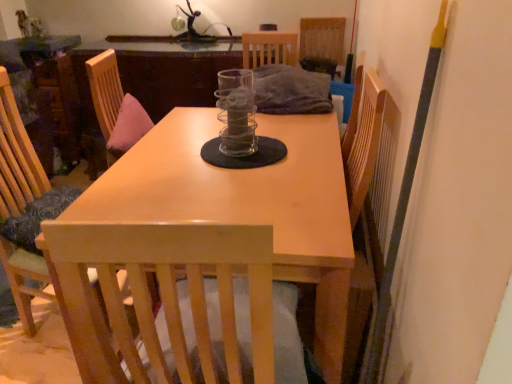
What do you see at coordinates (236, 112) in the screenshot? I see `clear glass jar at center` at bounding box center [236, 112].

Identify the location of clear glass jar at center. This screenshot has height=384, width=512. (236, 112).

From the image's perspective, is metallic glass sculpture at upper center above or below woven fabric chair at upper center, which is the second chair in bottom-to-top order?

Clearly, from the image's perspective, metallic glass sculpture at upper center is above woven fabric chair at upper center, which is the second chair in bottom-to-top order.

Are metallic glass sculpture at upper center and woven fabric chair at upper center, the 2th chair from the left, making contact?

No, metallic glass sculpture at upper center is not beside woven fabric chair at upper center, the 2th chair from the left.

Is metallic glass sculpture at upper center in front of or behind woven fabric chair at upper center, the 1th chair positioned from the top, in the image?

metallic glass sculpture at upper center is positioned farther from the viewer than woven fabric chair at upper center, the 1th chair positioned from the top.

Is wooden chair at left, arranged as the first chair when viewed from the front, outside of clear glass jar at center?

wooden chair at left, arranged as the first chair when viewed from the front, lies outside clear glass jar at center's area.

From a real-world perspective, which is physically below, wooden chair at left, arranged as the first chair when viewed from the front, or clear glass jar at center?

wooden chair at left, arranged as the first chair when viewed from the front, is physically lower.

Can you confirm if wooden chair at left, arranged as the first chair when viewed from the front, is positioned to the right of clear glass jar at center?

No, wooden chair at left, arranged as the first chair when viewed from the front, is not to the right of clear glass jar at center.

Where is `glass jar behind the wooden chair at left, arranged as the first chair when viewed from the front`? glass jar behind the wooden chair at left, arranged as the first chair when viewed from the front is located at coordinates (236, 112).

From a real-world perspective, is light wood table at center above or below wooden chair at left, arranged as the first chair when viewed from the front?

light wood table at center is below wooden chair at left, arranged as the first chair when viewed from the front.

Considering their positions, is light wood table at center located in front of or behind wooden chair at left, the 2th chair when ordered from top to bottom?

Visually, light wood table at center is located in front of wooden chair at left, the 2th chair when ordered from top to bottom.

Could you tell me if light wood table at center is turned towards wooden chair at left, marked as the first chair in a left-to-right arrangement?

Yes, light wood table at center is aimed at wooden chair at left, marked as the first chair in a left-to-right arrangement.

This screenshot has width=512, height=384. Find the location of `table located underneath the wooden chair at left, marked as the first chair in a left-to-right arrangement (from a real-world perspective)`. table located underneath the wooden chair at left, marked as the first chair in a left-to-right arrangement (from a real-world perspective) is located at coordinates (246, 203).

Would you say clear glass jar at center is inside or outside wooden chair at left, marked as the second chair in a right-to-left arrangement?

clear glass jar at center is located beyond the bounds of wooden chair at left, marked as the second chair in a right-to-left arrangement.

Visually, is clear glass jar at center positioned to the left or to the right of wooden chair at left, the 2th chair when ordered from top to bottom?

Based on their positions, clear glass jar at center is located to the right of wooden chair at left, the 2th chair when ordered from top to bottom.

Is clear glass jar at center behind wooden chair at left, marked as the second chair in a right-to-left arrangement?

Yes, clear glass jar at center is further from the camera.

Can you confirm if woven fabric chair at upper center, which is the second chair in front-to-back order, is smaller than metallic glass sculpture at upper center?

Actually, woven fabric chair at upper center, which is the second chair in front-to-back order, might be larger than metallic glass sculpture at upper center.

Is woven fabric chair at upper center, the 1th chair positioned from the top, placed right next to metallic glass sculpture at upper center?

They are not placed beside each other.

Is woven fabric chair at upper center, the 2th chair from the left, shorter than metallic glass sculpture at upper center?

No, woven fabric chair at upper center, the 2th chair from the left, is not shorter than metallic glass sculpture at upper center.

Where is `table lamp lying on the left of woven fabric chair at upper center, which is the second chair in front-to-back order`? This screenshot has width=512, height=384. table lamp lying on the left of woven fabric chair at upper center, which is the second chair in front-to-back order is located at coordinates (193, 29).

Between clear glass jar at center and metallic glass sculpture at upper center, which one appears on the left side from the viewer's perspective?

From the viewer's perspective, metallic glass sculpture at upper center appears more on the left side.

Which is in front, point (251, 117) or point (230, 37)?

The point (251, 117) is closer.

From a real-world perspective, is clear glass jar at center physically above metallic glass sculpture at upper center?

No, from a real-world perspective, clear glass jar at center is not on top of metallic glass sculpture at upper center.

Is light wood table at center beside metallic glass sculpture at upper center?

No, light wood table at center is not touching metallic glass sculpture at upper center.

How many degrees apart are the facing directions of light wood table at center and metallic glass sculpture at upper center?

87.1 degrees separate the facing orientations of light wood table at center and metallic glass sculpture at upper center.

From a real-world perspective, is light wood table at center under metallic glass sculpture at upper center?

Indeed, from a real-world perspective, light wood table at center is positioned beneath metallic glass sculpture at upper center.

Based on the photo, does light wood table at center appear on the right side of metallic glass sculpture at upper center?

Correct, you'll find light wood table at center to the right of metallic glass sculpture at upper center.

From the metallic glass sculpture at upper center, count 1st chairs forward and point to it. Please provide its 2D coordinates.

[(323, 38)]

The height and width of the screenshot is (384, 512). I want to click on glass jar on the right side of wooden chair at left, which is the first chair from bottom to top, so click(x=236, y=112).

Estimate the real-world distances between objects in this image. Which object is closer to metallic glass sculpture at upper center, wooden chair at left, placed as the 2th chair when sorted from back to front, or clear glass jar at center?

The object closer to metallic glass sculpture at upper center is clear glass jar at center.

Estimate the real-world distances between objects in this image. Which object is further from metallic glass sculpture at upper center, clear glass jar at center or light wood table at center?

light wood table at center lies further to metallic glass sculpture at upper center than the other object.

Which object lies further to the anchor point metallic glass sculpture at upper center, clear glass jar at center or woven fabric chair at upper center, the 1th chair positioned from the top?

Based on the image, clear glass jar at center appears to be further to metallic glass sculpture at upper center.

Looking at the image, which one is located further to wooden chair at left, arranged as the first chair when viewed from the front, light wood table at center or metallic glass sculpture at upper center?

metallic glass sculpture at upper center lies further to wooden chair at left, arranged as the first chair when viewed from the front, than the other object.

When comparing their distances from light wood table at center, does wooden chair at left, arranged as the first chair when viewed from the front, or metallic glass sculpture at upper center seem closer?

wooden chair at left, arranged as the first chair when viewed from the front, is closer to light wood table at center.

Based on the photo, based on their spatial positions, is metallic glass sculpture at upper center or wooden chair at left, marked as the first chair in a left-to-right arrangement, further from clear glass jar at center?

Among the two, metallic glass sculpture at upper center is located further to clear glass jar at center.

Estimate the real-world distances between objects in this image. Which object is closer to wooden chair at left, placed as the 2th chair when sorted from back to front, metallic glass sculpture at upper center or woven fabric chair at upper center, which is the second chair in front-to-back order?

Based on the image, metallic glass sculpture at upper center appears to be nearer to wooden chair at left, placed as the 2th chair when sorted from back to front.

Looking at the image, which one is located closer to metallic glass sculpture at upper center, light wood table at center or wooden chair at left, the 2th chair when ordered from top to bottom?

Among the two, wooden chair at left, the 2th chair when ordered from top to bottom, is located nearer to metallic glass sculpture at upper center.

You are a GUI agent. You are given a task and a screenshot of the screen. Output one action in this format:
    pyautogui.click(x=<x>, y=<y>)
    Task: Click on the chair between wooden chair at left, the 2th chair when ordered from top to bottom, and metallic glass sculpture at upper center from front to back
    This screenshot has width=512, height=384.
    Given the screenshot: What is the action you would take?
    pyautogui.click(x=323, y=38)

Identify the location of chair positioned between clear glass jar at center and metallic glass sculpture at upper center from near to far. (323, 38).

Locate an element on the screen. chair between light wood table at center and woven fabric chair at upper center, the first chair in the right-to-left sequence, from front to back is located at coordinates (17, 157).

At what (x,y) coordinates should I click in order to perform the action: click on glass jar between wooden chair at left, arranged as the first chair when viewed from the front, and woven fabric chair at upper center, which is the second chair in bottom-to-top order, in the front-back direction. Please return your answer as a coordinate pair (x, y). Looking at the image, I should click on (236, 112).